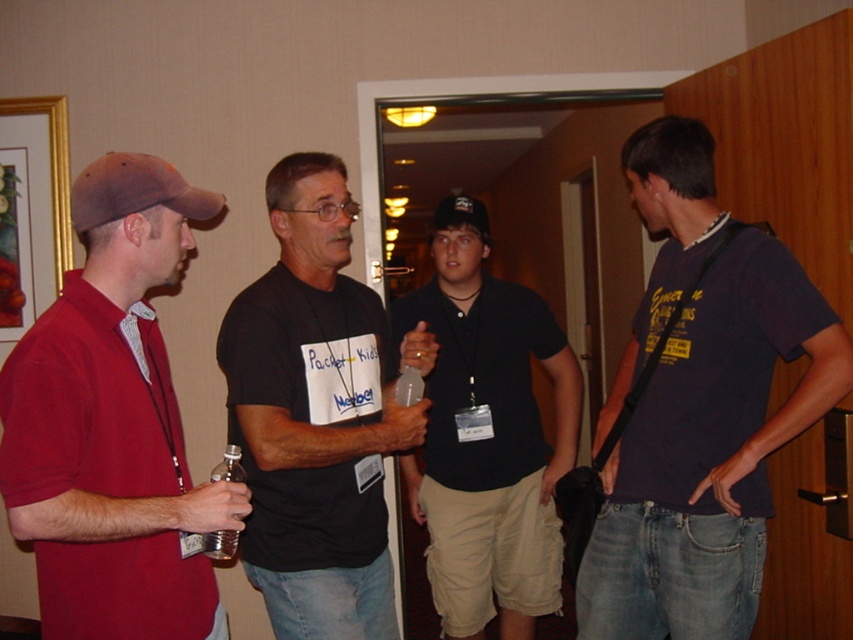
Is matte red polo shirt at left to the right of dark blue shirt at center from the viewer's perspective?

In fact, matte red polo shirt at left is to the left of dark blue shirt at center.

Can you confirm if matte red polo shirt at left is wider than dark blue shirt at center?

No, matte red polo shirt at left is not wider than dark blue shirt at center.

This screenshot has height=640, width=853. Find the location of `matte red polo shirt at left`. matte red polo shirt at left is located at coordinates (112, 424).

Image resolution: width=853 pixels, height=640 pixels. What are the coordinates of `matte red polo shirt at left` in the screenshot? It's located at (112, 424).

Can you confirm if matte red polo shirt at left is smaller than translucent plastic bottle at center?

Actually, matte red polo shirt at left might be larger than translucent plastic bottle at center.

Which is in front, point (83, 625) or point (207, 532)?

Point (83, 625) is in front.

Does point (144, 349) come in front of point (219, 552)?

That is False.

The height and width of the screenshot is (640, 853). In order to click on matte red polo shirt at left in this screenshot , I will do `click(112, 424)`.

Is point (241, 548) closer to viewer compared to point (212, 538)?

No, (241, 548) is behind (212, 538).

Who is taller, black matte t-shirt at center or translucent plastic bottle at center?

Standing taller between the two is black matte t-shirt at center.

Locate an element on the screen. This screenshot has width=853, height=640. black matte t-shirt at center is located at coordinates (315, 417).